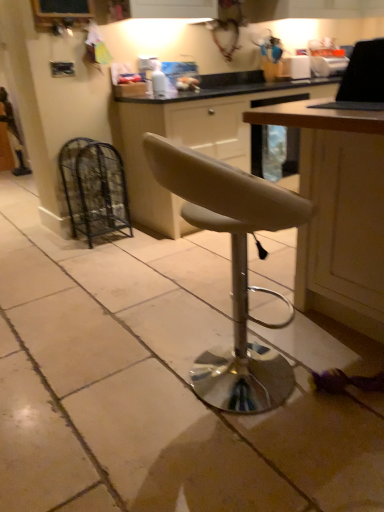
Question: From a real-world perspective, does black glossy laptop at upper right sit lower than wooden table at right?

Choices:
 (A) yes
 (B) no

Answer: (B)

Question: From a real-world perspective, is black glossy laptop at upper right located higher than wooden table at right?

Choices:
 (A) yes
 (B) no

Answer: (A)

Question: Is black glossy laptop at upper right with wooden table at right?

Choices:
 (A) no
 (B) yes

Answer: (A)

Question: Is black glossy laptop at upper right outside of wooden table at right?

Choices:
 (A) no
 (B) yes

Answer: (B)

Question: Could wooden table at right be considered to be inside black glossy laptop at upper right?

Choices:
 (A) yes
 (B) no

Answer: (B)

Question: Would you say wooden table at right is inside or outside matte beige cabinet at center?

Choices:
 (A) inside
 (B) outside

Answer: (B)

Question: Considering the positions of wooden table at right and matte beige cabinet at center in the image, is wooden table at right taller or shorter than matte beige cabinet at center?

Choices:
 (A) short
 (B) tall

Answer: (A)

Question: In terms of width, does wooden table at right look wider or thinner when compared to matte beige cabinet at center?

Choices:
 (A) wide
 (B) thin

Answer: (A)

Question: Considering the relative positions of wooden table at right and matte beige cabinet at center in the image provided, is wooden table at right to the left or to the right of matte beige cabinet at center?

Choices:
 (A) right
 (B) left

Answer: (A)

Question: From their relative heights in the image, would you say matte beige cabinet at center is taller or shorter than black wire mesh cage at left?

Choices:
 (A) short
 (B) tall

Answer: (B)

Question: In the image, is matte beige cabinet at center positioned in front of or behind black wire mesh cage at left?

Choices:
 (A) front
 (B) behind

Answer: (A)

Question: Looking at the image, does matte beige cabinet at center seem bigger or smaller compared to black wire mesh cage at left?

Choices:
 (A) big
 (B) small

Answer: (A)

Question: Is matte beige cabinet at center spatially inside black wire mesh cage at left, or outside of it?

Choices:
 (A) inside
 (B) outside

Answer: (B)

Question: In terms of height, does black wire mesh cage at left look taller or shorter compared to beige leather stool at center?

Choices:
 (A) short
 (B) tall

Answer: (A)

Question: Relative to beige leather stool at center, is black wire mesh cage at left in front or behind?

Choices:
 (A) front
 (B) behind

Answer: (B)